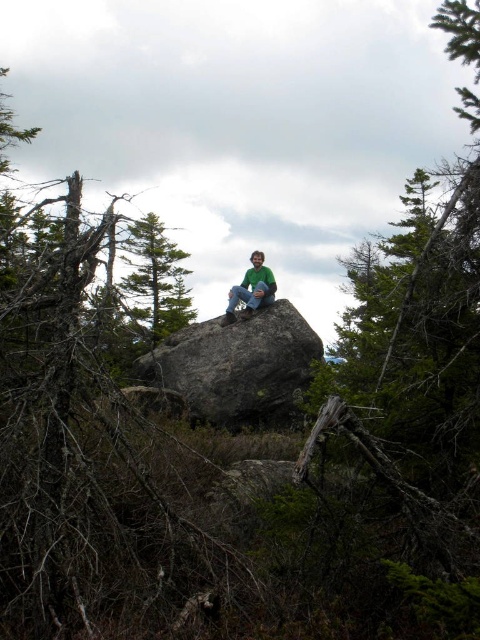
Question: Can you confirm if brown bark tree at center is thinner than gray rough boulder at center?

Choices:
 (A) no
 (B) yes

Answer: (A)

Question: Which of the following is the closest to the observer?

Choices:
 (A) green matte shirt at center
 (B) gray rough boulder at center

Answer: (B)

Question: Can you confirm if green textured pine tree at center is smaller than green matte shirt at center?

Choices:
 (A) yes
 (B) no

Answer: (B)

Question: Does gray rough boulder at center appear over green textured pine tree at center?

Choices:
 (A) yes
 (B) no

Answer: (B)

Question: Which object is closer to the camera taking this photo?

Choices:
 (A) brown bark tree at center
 (B) green textured pine tree at center
 (C) green matte shirt at center
 (D) gray rough boulder at center

Answer: (A)

Question: Which object is the closest to the gray rough boulder at center?

Choices:
 (A) green textured pine tree at center
 (B) brown bark tree at center

Answer: (B)